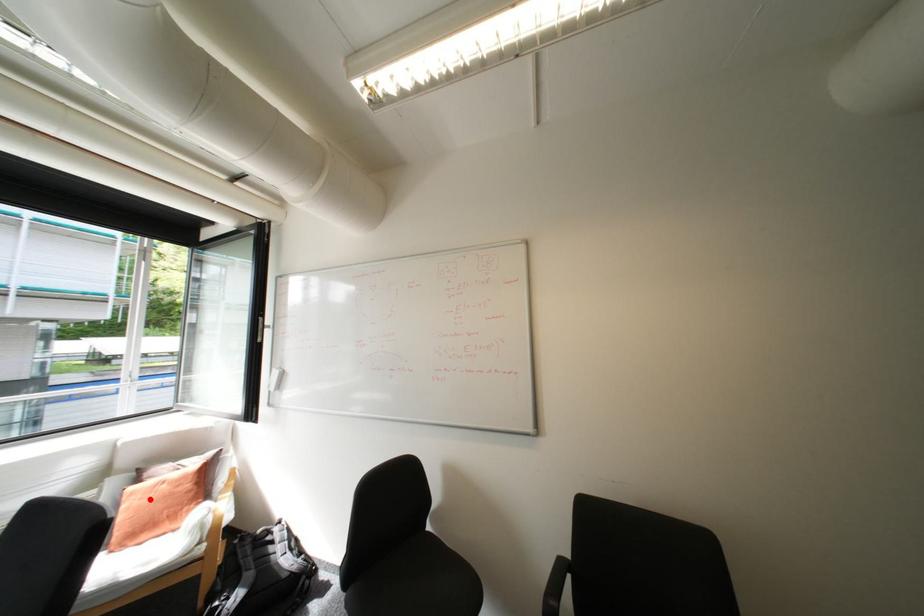
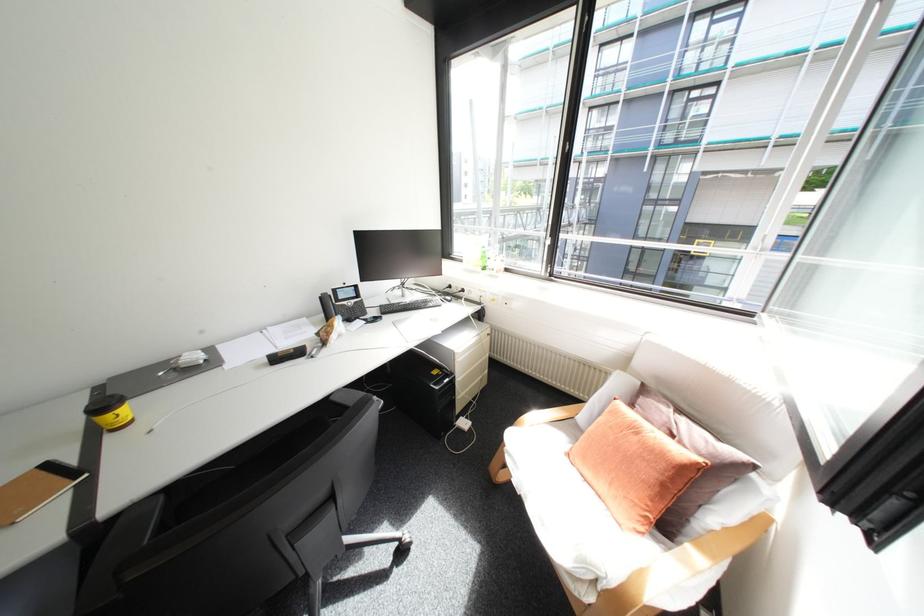
In the second image, find the point that corresponds to the highlighted location in the first image.

(621, 428)